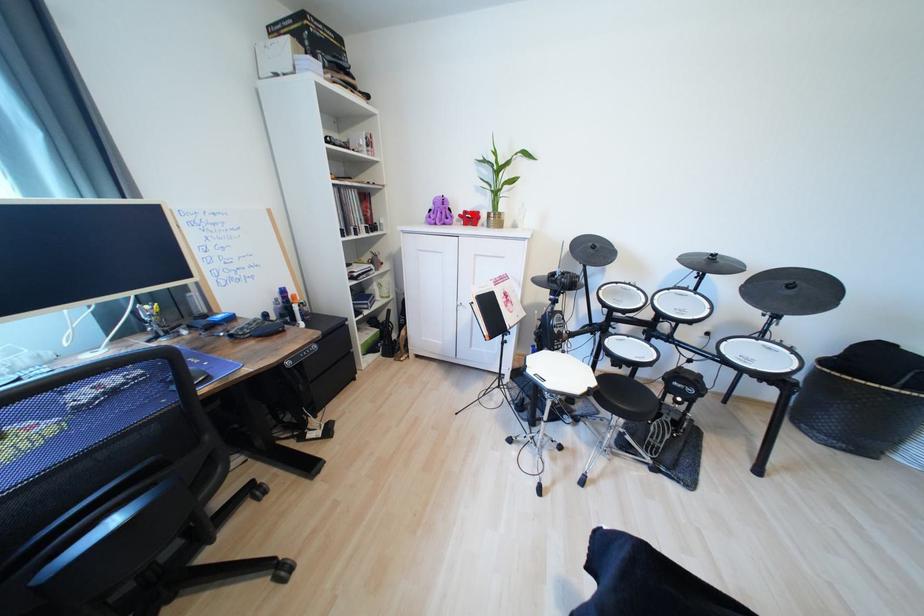
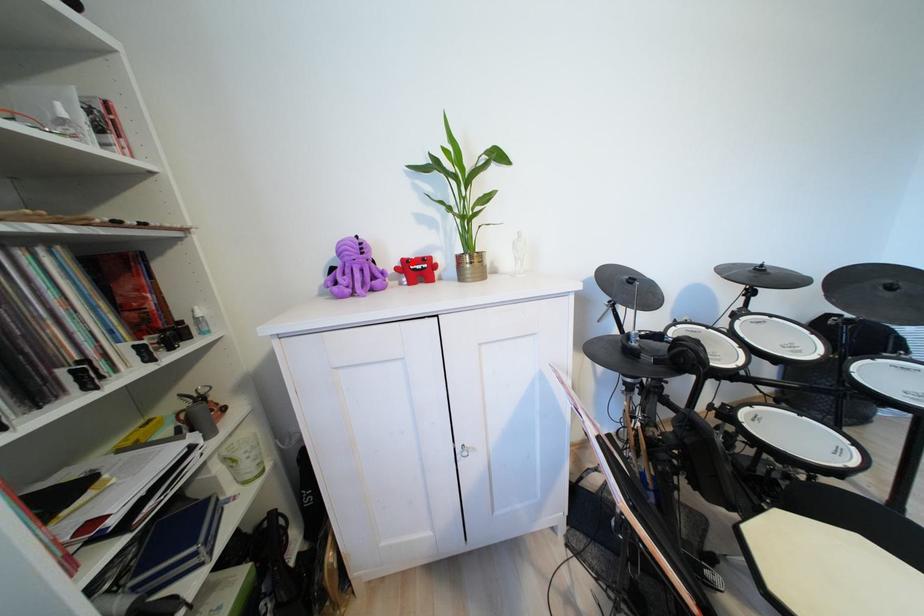
I am providing you with two images of the same scene from different viewpoints. A red point is marked on the first image and another point is marked on the second image. Is the marked point in image1 the same physical position as the marked point in image2?

Yes